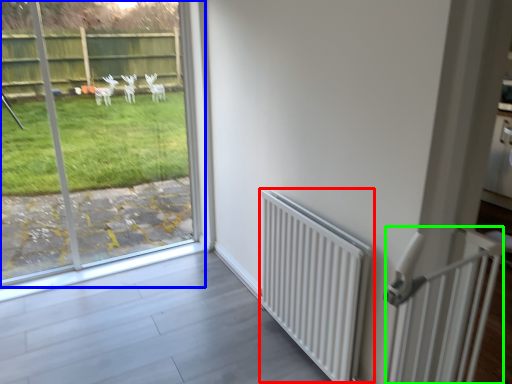
Question: Estimate the real-world distances between objects in this image. Which object is closer to radiator (highlighted by a red box), window (highlighted by a blue box) or balustrade (highlighted by a green box)?

Choices:
 (A) window
 (B) balustrade

Answer: (B)